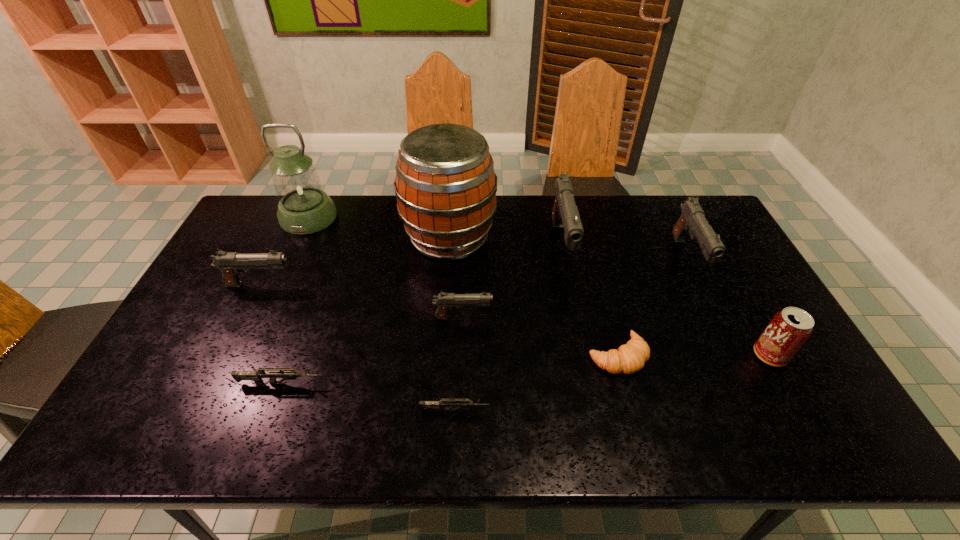
You are a GUI agent. You are given a task and a screenshot of the screen. Output one action in this format:
    pyautogui.click(x=<x>, y=<y>)
    Task: Click on the blank area located 0.090m in the direction the second tallest gun is aimed
    
    Given the screenshot: What is the action you would take?
    pyautogui.click(x=713, y=310)

Locate an element on the screen. vacant space located on the left of the red soda can is located at coordinates (638, 355).

Identify the location of vacant area situated in the direction the second smallest gray gun is aimed. The image size is (960, 540). (320, 285).

This screenshot has width=960, height=540. Find the location of `free location located in the direction the smallest gray gun is aimed`. free location located in the direction the smallest gray gun is aimed is located at coordinates (606, 318).

Identify the location of vacant space situated 0.270m aimed along the barrel of the second shortest gun. (435, 383).

You are a GUI agent. You are given a task and a screenshot of the screen. Output one action in this format:
    pyautogui.click(x=<x>, y=<y>)
    Task: Click on the free point located on the right of the crescent roll
    Image resolution: width=960 pixels, height=540 pixels.
    Given the screenshot: What is the action you would take?
    coord(742,356)

Identify the location of blank space located aimed along the barrel of the nearest object. This screenshot has height=540, width=960. pyautogui.click(x=527, y=410).

Locate an element on the screen. This screenshot has height=540, width=960. cider that is at the far edge is located at coordinates (445, 185).

Identify the location of lantern that is at the far edge. The image size is (960, 540). tap(304, 208).

Find the location of a particular element. The width and height of the screenshot is (960, 540). object at the near edge is located at coordinates (460, 403).